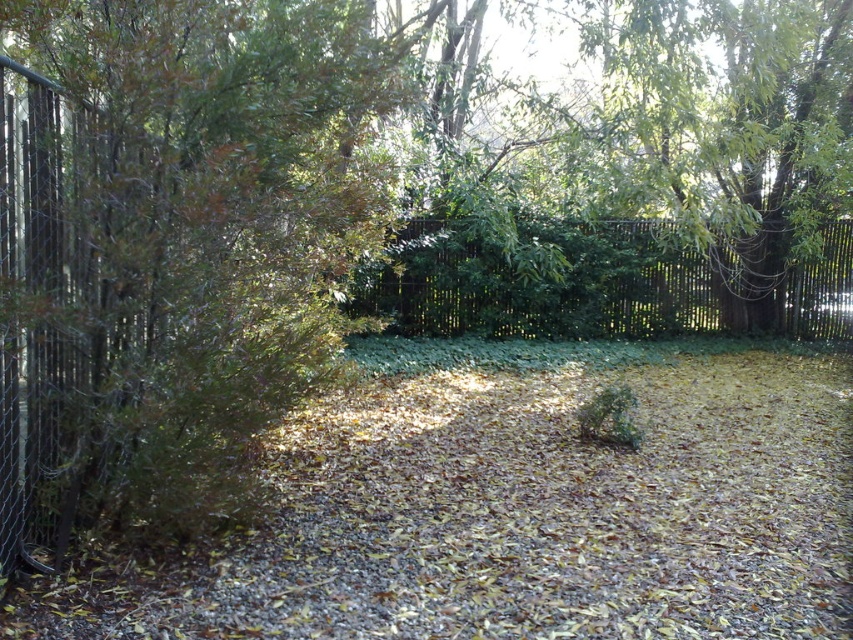
Can you confirm if metallic chain-link fence at left is thinner than green wooden fence at center?

No.

Does metallic chain-link fence at left lie in front of green wooden fence at center?

That is True.

Which is behind, point (16, 529) or point (689, 308)?

Positioned behind is point (689, 308).

Identify the location of metallic chain-link fence at left. The height and width of the screenshot is (640, 853). (48, 305).

Who is taller, green leafy tree at left or green wooden fence at center?

With more height is green leafy tree at left.

What are the coordinates of `green leafy tree at left` in the screenshot? It's located at (177, 244).

The image size is (853, 640). In order to click on green leafy tree at left in this screenshot , I will do `click(177, 244)`.

Does green leafy tree at left have a smaller size compared to metallic chain-link fence at left?

Actually, green leafy tree at left might be larger than metallic chain-link fence at left.

Which is more to the right, green leafy tree at left or metallic chain-link fence at left?

Positioned to the right is green leafy tree at left.

Is point (230, 168) closer to camera compared to point (103, 314)?

That is True.

The height and width of the screenshot is (640, 853). Identify the location of green leafy tree at left. (177, 244).